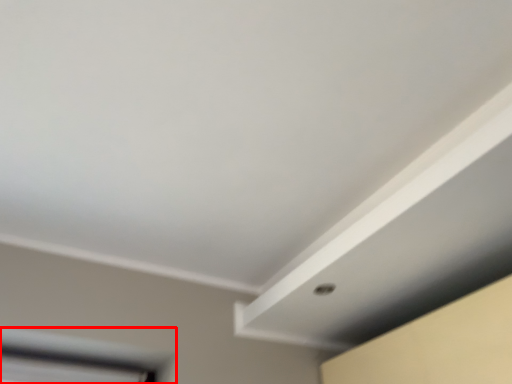
Question: From the image's perspective, where is window (annotated by the red box) located relative to exhaust hood?

Choices:
 (A) above
 (B) below

Answer: (B)